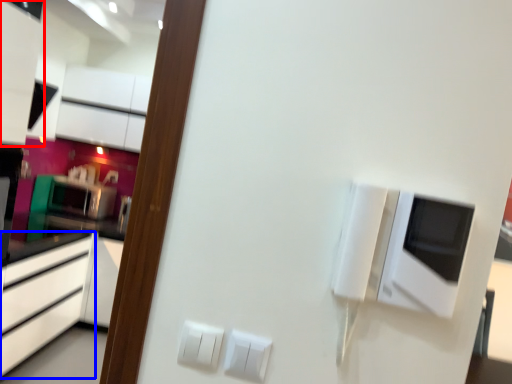
Question: Among these objects, which one is nearest to the camera, cabinetry (highlighted by a red box) or cabinetry (highlighted by a blue box)?

Choices:
 (A) cabinetry
 (B) cabinetry

Answer: (B)